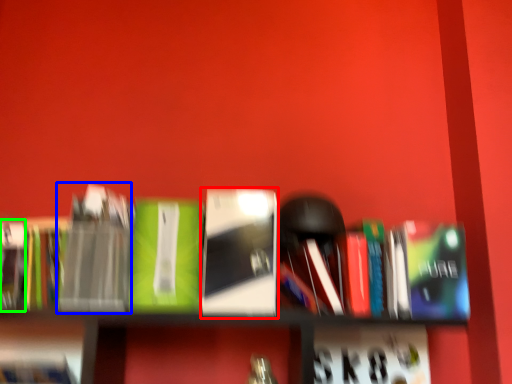
Question: Which object is the closest to the book (highlighted by a red box)? Choose among these: paperback book (highlighted by a blue box) or paperback book (highlighted by a green box).

Choices:
 (A) paperback book
 (B) paperback book

Answer: (A)